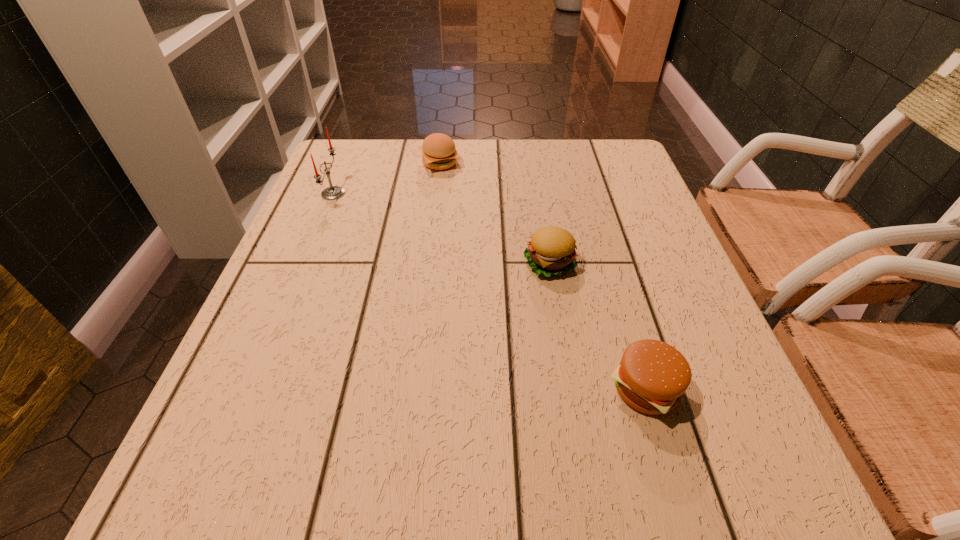
You are a GUI agent. You are given a task and a screenshot of the screen. Output one action in this format:
    pyautogui.click(x=<x>, y=<y>)
    Task: Click on the free spot located on the front of the second hamburger from left to right
    Image resolution: width=960 pixels, height=540 pixels.
    Given the screenshot: What is the action you would take?
    pyautogui.click(x=570, y=390)

What are the coordinates of `vacant position located 0.390m on the left of the rightmost hamburger` in the screenshot? It's located at (358, 388).

Where is `candle that is at the far edge`? The width and height of the screenshot is (960, 540). candle that is at the far edge is located at coordinates (333, 192).

This screenshot has width=960, height=540. Identify the location of hamburger that is at the far edge. (439, 152).

What are the coordinates of `object that is positioned at the left edge` in the screenshot? It's located at (333, 192).

Where is `object located at the right edge`? The width and height of the screenshot is (960, 540). object located at the right edge is located at coordinates (652, 376).

Find the location of a particular element. Image resolution: width=960 pixels, height=540 pixels. object positioned at the far left corner is located at coordinates (333, 192).

Identify the location of free space at the far edge of the desktop. The width and height of the screenshot is (960, 540). (508, 142).

You are a GUI agent. You are given a task and a screenshot of the screen. Output one action in this format:
    pyautogui.click(x=<x>, y=<y>)
    Task: Click on the vacant space at the near edge of the desktop
    This screenshot has height=540, width=960.
    Given the screenshot: What is the action you would take?
    pyautogui.click(x=622, y=477)

Identify the location of free space at the left edge of the desktop. This screenshot has width=960, height=540. (342, 293).